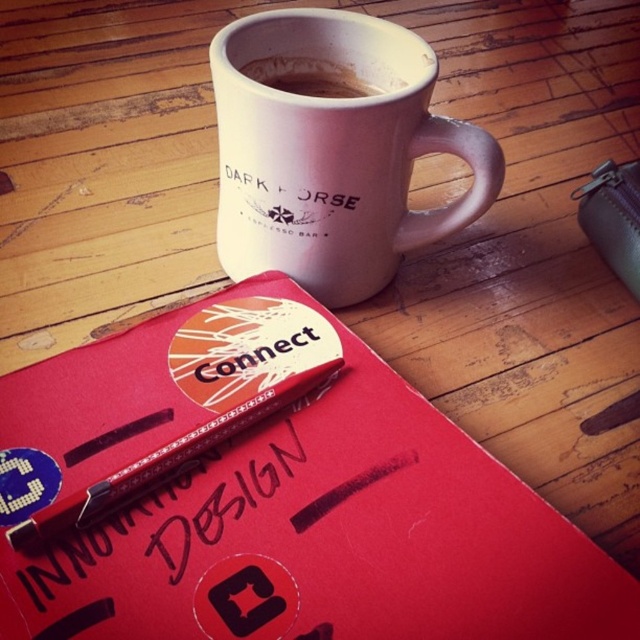
Question: Considering the real-world distances, which object is closest to the metallic silver pen at center?

Choices:
 (A) black pen at center
 (B) red matte notebook at upper center
 (C) white matte mug at upper center
 (D) dark matte coffee cup at upper center

Answer: (A)

Question: Which object is the farthest from the metallic silver pen at center?

Choices:
 (A) dark matte coffee cup at upper center
 (B) black pen at center
 (C) white matte mug at upper center
 (D) red matte notebook at upper center

Answer: (A)

Question: Is white matte mug at upper center positioned in front of dark matte coffee cup at upper center?

Choices:
 (A) yes
 (B) no

Answer: (A)

Question: Does red matte notebook at upper center have a lesser width compared to metallic silver pen at center?

Choices:
 (A) yes
 (B) no

Answer: (B)

Question: Where is metallic silver pen at center located in relation to dark matte coffee cup at upper center in the image?

Choices:
 (A) above
 (B) below

Answer: (B)

Question: Which point is closer to the camera?

Choices:
 (A) red matte notebook at upper center
 (B) dark matte coffee cup at upper center

Answer: (A)